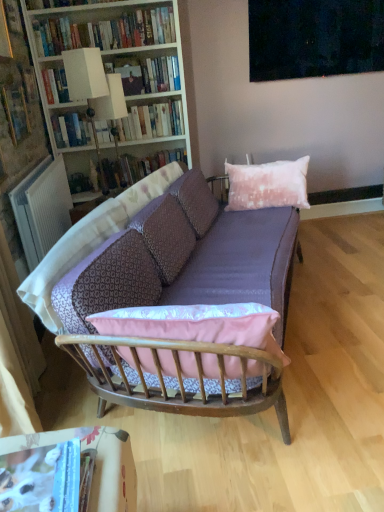
You are a GUI agent. You are given a task and a screenshot of the screen. Output one action in this format:
    pyautogui.click(x=<x>, y=<y>)
    Task: Click on the free point above hardcover books at upper left, arranged as the 4th book when viewed from the back (from a real-world perspective)
    This screenshot has height=512, width=384.
    Given the screenshot: What is the action you would take?
    pyautogui.click(x=110, y=12)